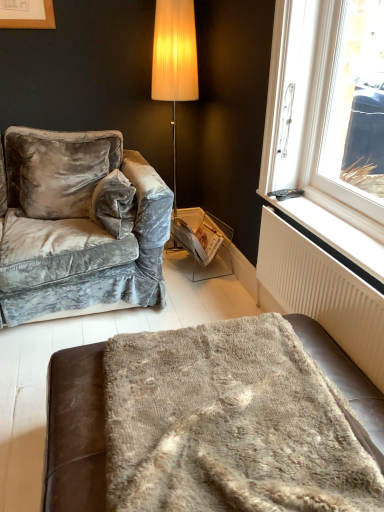
Question: Is white glossy magazine at center outside velvet gray couch at left?

Choices:
 (A) yes
 (B) no

Answer: (A)

Question: Can you confirm if white glossy magazine at center is taller than velvet gray couch at left?

Choices:
 (A) no
 (B) yes

Answer: (A)

Question: Does white glossy magazine at center appear on the left side of velvet gray couch at left?

Choices:
 (A) no
 (B) yes

Answer: (A)

Question: From a real-world perspective, is white glossy magazine at center on velvet gray couch at left?

Choices:
 (A) no
 (B) yes

Answer: (A)

Question: Is white glossy magazine at center further to camera compared to velvet gray couch at left?

Choices:
 (A) yes
 (B) no

Answer: (A)

Question: Is fuzzy beige blanket at lower center taller or shorter than white plastic radiator at lower right?

Choices:
 (A) tall
 (B) short

Answer: (A)

Question: From the image's perspective, is fuzzy beige blanket at lower center above or below white plastic radiator at lower right?

Choices:
 (A) above
 (B) below

Answer: (B)

Question: Is fuzzy beige blanket at lower center situated inside white plastic radiator at lower right or outside?

Choices:
 (A) inside
 (B) outside

Answer: (B)

Question: Visually, is fuzzy beige blanket at lower center positioned to the left or to the right of white plastic radiator at lower right?

Choices:
 (A) left
 (B) right

Answer: (A)

Question: Relative to velvet gray couch at left, is white textured radiator at lower right in front or behind?

Choices:
 (A) behind
 (B) front

Answer: (B)

Question: From the image's perspective, relative to velvet gray couch at left, is white textured radiator at lower right above or below?

Choices:
 (A) above
 (B) below

Answer: (B)

Question: Would you say white textured radiator at lower right is inside or outside velvet gray couch at left?

Choices:
 (A) outside
 (B) inside

Answer: (A)

Question: Is point (263, 207) closer or farther from the camera than point (56, 151)?

Choices:
 (A) farther
 (B) closer

Answer: (B)

Question: Considering the positions of white plastic window at upper right and fuzzy beige blanket at lower center in the image, is white plastic window at upper right taller or shorter than fuzzy beige blanket at lower center?

Choices:
 (A) short
 (B) tall

Answer: (B)

Question: Visually, is white plastic window at upper right positioned to the left or to the right of fuzzy beige blanket at lower center?

Choices:
 (A) left
 (B) right

Answer: (B)